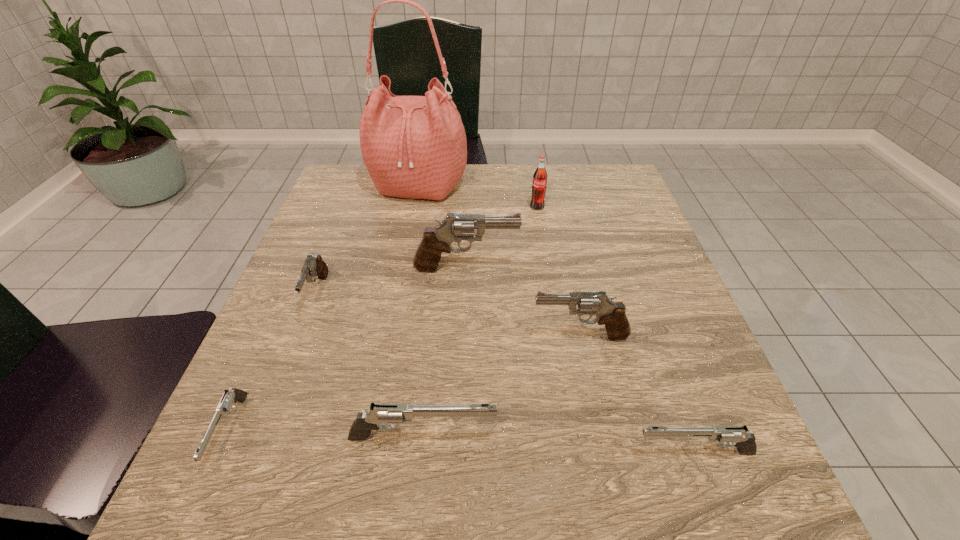
Identify which gray pistol is the second closest to the tallest pistol. Please provide its 2D coordinates. Your answer should be formatted as a tuple, i.e. [(x, y)], where the tuple contains the x and y coordinates of a point satisfying the conditions above.

[(314, 267)]

Choose which gray pistol is the nearest neighbor to the second pistol from left to right. Please provide its 2D coordinates. Your answer should be formatted as a tuple, i.e. [(x, y)], where the tuple contains the x and y coordinates of a point satisfying the conditions above.

[(436, 240)]

Locate an element on the screen. The height and width of the screenshot is (540, 960). silver pistol that is the closest to the third farthest pistol is located at coordinates (396, 413).

Identify which silver pistol is the third nearest to the tallest object. Please provide its 2D coordinates. Your answer should be formatted as a tuple, i.e. [(x, y)], where the tuple contains the x and y coordinates of a point satisfying the conditions above.

[(738, 436)]